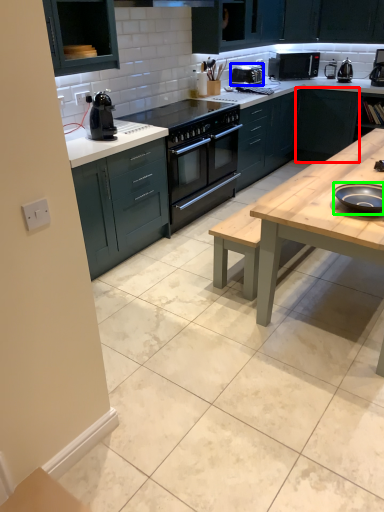
Question: Which is farther away from cabinetry (highlighted by a red box)? appliance (highlighted by a blue box) or appliance (highlighted by a green box)?

Choices:
 (A) appliance
 (B) appliance

Answer: (B)